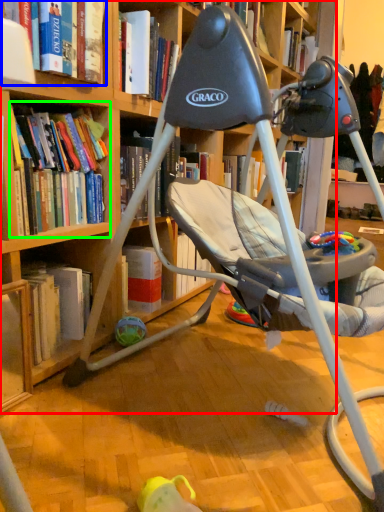
Question: Estimate the real-world distances between objects in this image. Which object is closer to bookcase (highlighted by a red box), book (highlighted by a blue box) or book (highlighted by a green box)?

Choices:
 (A) book
 (B) book

Answer: (B)